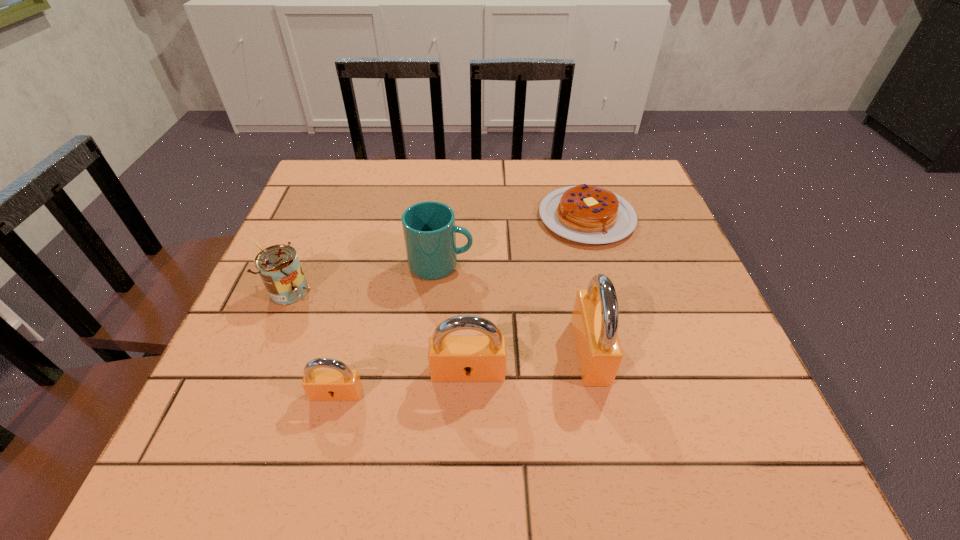
Identify the location of free space located on the right of the can. The height and width of the screenshot is (540, 960). (372, 289).

Image resolution: width=960 pixels, height=540 pixels. In order to click on vacant area situated on the handle side of the cup in this screenshot , I will do `click(540, 265)`.

Locate an element on the screen. The image size is (960, 540). object positioned at the far edge is located at coordinates (583, 213).

I want to click on object present at the left edge, so click(279, 267).

At what (x,y) coordinates should I click in order to perform the action: click on object situated at the right edge. Please return your answer as a coordinate pair (x, y). Looking at the image, I should click on (583, 213).

I want to click on object that is at the far right corner, so point(583,213).

Where is `vacant space at the far edge of the desktop`? This screenshot has height=540, width=960. vacant space at the far edge of the desktop is located at coordinates (452, 180).

What are the coordinates of `vacant space at the near edge of the desktop` in the screenshot? It's located at (598, 406).

You are a GUI agent. You are given a task and a screenshot of the screen. Output one action in this format:
    pyautogui.click(x=<x>, y=<y>)
    Task: Click on the free space at the left edge of the desktop
    The image size is (960, 540).
    Given the screenshot: What is the action you would take?
    pyautogui.click(x=322, y=215)

This screenshot has width=960, height=540. What are the coordinates of `vacant space at the right edge of the desktop` in the screenshot? It's located at 692,330.